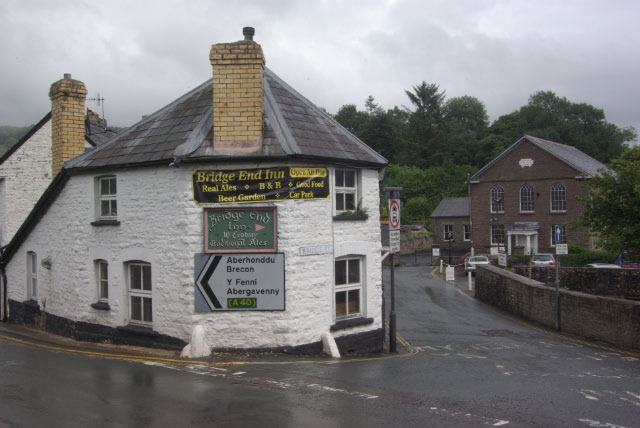
At what (x,y) coordinates should I click in order to perform the action: click on wall. Please return your answer as a coordinate pair (x, y). This screenshot has height=428, width=640. Looking at the image, I should click on (570, 318).